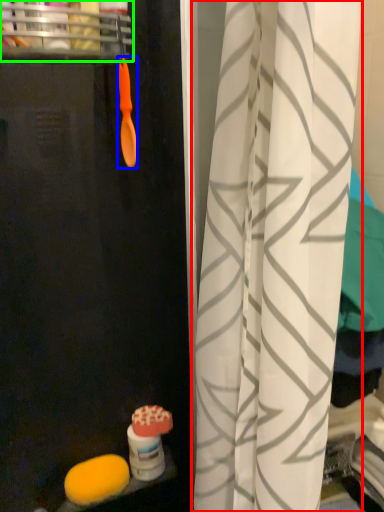
Question: Based on their relative distances, which object is nearer to curtain (highlighted by a red box)? Choose from brush (highlighted by a blue box) and shelf (highlighted by a green box).

Choices:
 (A) brush
 (B) shelf

Answer: (A)